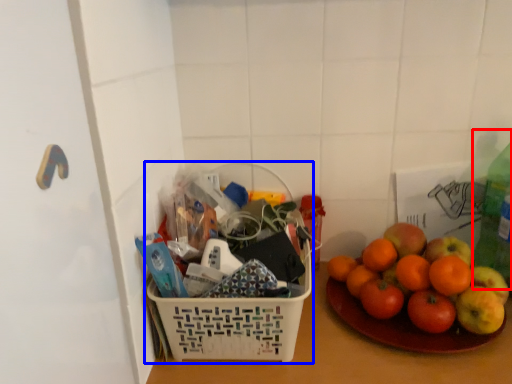
Question: Among these objects, which one is farthest to the camera, bottle (highlighted by a red box) or basket (highlighted by a blue box)?

Choices:
 (A) bottle
 (B) basket

Answer: (A)